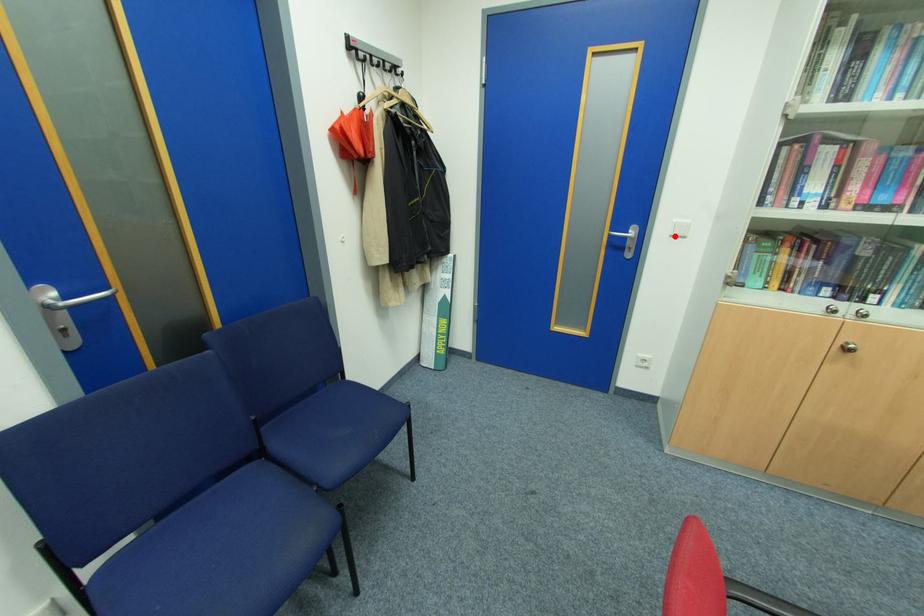
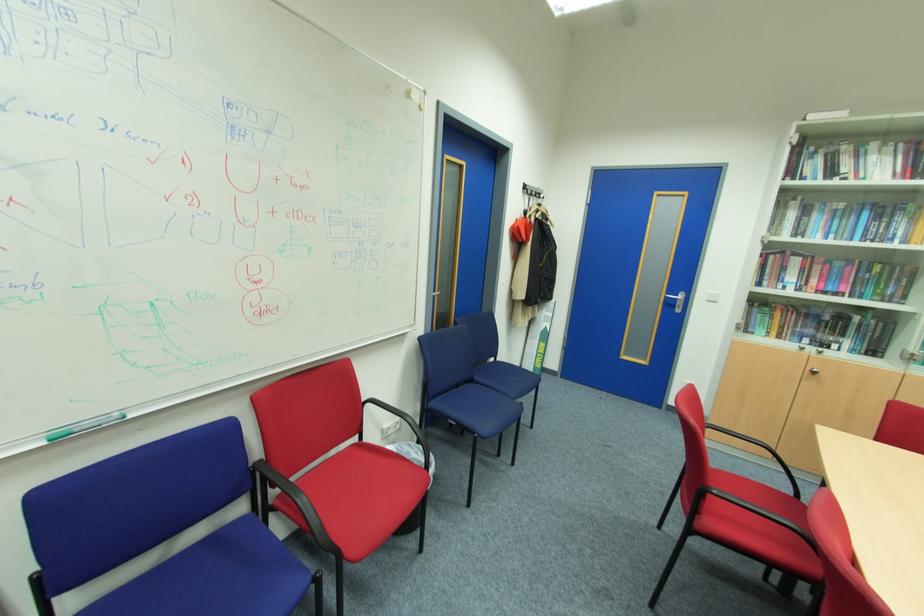
Where in the second image is the point corresponding to the highlighted location from the first image?

(711, 301)